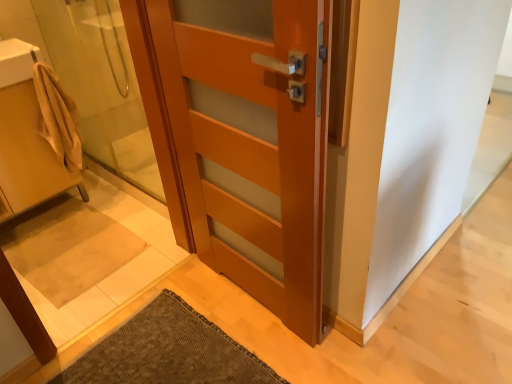
In order to face beige cotton bathrobe at left, should I rotate leftwards or rightwards?

Rotate your view left by about 25.017°.

What is the approximate height of beige fabric bath mat at lower left?

2.18 inches.

Where is `beige cotton bathrobe at left`? beige cotton bathrobe at left is located at coordinates (57, 117).

From the image's perspective, which one is positioned higher, beige fabric bath mat at lower left or white glossy sink at upper left, the first sink when ordered from top to bottom?

white glossy sink at upper left, the first sink when ordered from top to bottom, appears higher in the image.

Considering the sizes of beige fabric bath mat at lower left and white glossy sink at upper left, the first sink when ordered from top to bottom, in the image, is beige fabric bath mat at lower left wider or thinner than white glossy sink at upper left, the first sink when ordered from top to bottom,?

Clearly, beige fabric bath mat at lower left has more width compared to white glossy sink at upper left, the first sink when ordered from top to bottom.

Which is in front, beige fabric bath mat at lower left or white glossy sink at upper left, which ranks as the second sink in bottom-to-top order?

white glossy sink at upper left, which ranks as the second sink in bottom-to-top order.

Who is taller, beige fabric bath mat at lower left or white glossy sink at upper left, the first sink when ordered from top to bottom?

white glossy sink at upper left, the first sink when ordered from top to bottom, is taller.

Is matte wood door at center positioned with its back to beige fabric towel at left, which ranks as the first sink in bottom-to-top order?

No, matte wood door at center's orientation is not away from beige fabric towel at left, which ranks as the first sink in bottom-to-top order.

Is matte wood door at center not near beige fabric towel at left, the second sink positioned from the top?

Yes, matte wood door at center is far from beige fabric towel at left, the second sink positioned from the top.

Considering the positions of point (213, 44) and point (47, 187), is point (213, 44) closer or farther from the camera than point (47, 187)?

Point (213, 44) is closer to the camera than point (47, 187).

Considering the sizes of matte wood door at center and beige fabric towel at left, the second sink positioned from the top, in the image, is matte wood door at center bigger or smaller than beige fabric towel at left, the second sink positioned from the top,?

Clearly, matte wood door at center is smaller in size than beige fabric towel at left, the second sink positioned from the top.

In terms of height, does beige cotton bathrobe at left look taller or shorter compared to translucent glass shower door at left?

In the image, beige cotton bathrobe at left appears to be shorter than translucent glass shower door at left.

Locate an element on the screen. shower door that is in front of the beige cotton bathrobe at left is located at coordinates (101, 85).

Considering the positions of objects beige cotton bathrobe at left and translucent glass shower door at left in the image provided, who is more to the right, beige cotton bathrobe at left or translucent glass shower door at left?

translucent glass shower door at left is more to the right.

Consider the image. From a real-world perspective, is white glossy sink at upper left, which ranks as the second sink in bottom-to-top order, physically below beige fabric towel at left, which ranks as the first sink in bottom-to-top order?

No, from a real-world perspective, white glossy sink at upper left, which ranks as the second sink in bottom-to-top order, is not beneath beige fabric towel at left, which ranks as the first sink in bottom-to-top order.

Is white glossy sink at upper left, which ranks as the second sink in bottom-to-top order, touching beige fabric towel at left, the second sink positioned from the top?

No, white glossy sink at upper left, which ranks as the second sink in bottom-to-top order, is not making contact with beige fabric towel at left, the second sink positioned from the top.

Could you tell me if white glossy sink at upper left, the first sink when ordered from top to bottom, is facing beige fabric towel at left, which ranks as the first sink in bottom-to-top order?

No, white glossy sink at upper left, the first sink when ordered from top to bottom, is not oriented towards beige fabric towel at left, which ranks as the first sink in bottom-to-top order.

How different are the orientations of white glossy sink at upper left, the first sink when ordered from top to bottom, and beige fabric towel at left, the second sink positioned from the top, in degrees?

They differ by 0.000261 degrees in their facing directions.

Which sink is the 2nd one when counting from the left side of the translucent glass shower door at left? Please provide its 2D coordinates.

[(25, 137)]

Is translucent glass shower door at left surrounding beige fabric towel at left, which ranks as the first sink in bottom-to-top order?

No, translucent glass shower door at left does not contain beige fabric towel at left, which ranks as the first sink in bottom-to-top order.

Is the depth of translucent glass shower door at left less than that of beige fabric towel at left, which ranks as the first sink in bottom-to-top order?

Yes, translucent glass shower door at left is in front of beige fabric towel at left, which ranks as the first sink in bottom-to-top order.

Considering the sizes of translucent glass shower door at left and beige fabric towel at left, which ranks as the first sink in bottom-to-top order, in the image, is translucent glass shower door at left bigger or smaller than beige fabric towel at left, which ranks as the first sink in bottom-to-top order,?

Considering their sizes, translucent glass shower door at left takes up less space than beige fabric towel at left, which ranks as the first sink in bottom-to-top order.

Is beige cotton bathrobe at left further to camera compared to matte wood door at center?

That is True.

In the image, is beige cotton bathrobe at left on the left side or the right side of matte wood door at center?

In the image, beige cotton bathrobe at left appears on the left side of matte wood door at center.

Who is shorter, beige cotton bathrobe at left or matte wood door at center?

With less height is beige cotton bathrobe at left.

Find the location of a particular element. Image resolution: width=512 pixels, height=384 pixels. the 1st sink above the beige fabric bath mat at lower left (from a real-world perspective) is located at coordinates (25, 137).

Consider the image. Does beige fabric towel at left, which ranks as the first sink in bottom-to-top order, have a lesser height compared to beige fabric bath mat at lower left?

Incorrect, the height of beige fabric towel at left, which ranks as the first sink in bottom-to-top order, does not fall short of that of beige fabric bath mat at lower left.

Measure the distance from beige fabric towel at left, which ranks as the first sink in bottom-to-top order, to beige fabric bath mat at lower left.

beige fabric towel at left, which ranks as the first sink in bottom-to-top order, is 15.34 inches away from beige fabric bath mat at lower left.

From a real-world perspective, between beige fabric towel at left, the second sink positioned from the top, and beige fabric bath mat at lower left, who is vertically lower?

In real-world perspective, beige fabric bath mat at lower left is lower.

This screenshot has height=384, width=512. What are the coordinates of `bath mat below the white glossy sink at upper left, the first sink when ordered from top to bottom (from the image's perspective)` in the screenshot? It's located at (67, 247).

Which sink is the 2nd one when counting from the left side of the matte wood door at center? Please provide its 2D coordinates.

[(25, 137)]

Based on their spatial positions, is beige fabric towel at left, which ranks as the first sink in bottom-to-top order, or white glossy sink at upper left, which ranks as the second sink in bottom-to-top order, further from matte wood door at center?

Among the two, white glossy sink at upper left, which ranks as the second sink in bottom-to-top order, is located further to matte wood door at center.

Based on their spatial positions, is beige fabric towel at left, which ranks as the first sink in bottom-to-top order, or beige fabric bath mat at lower left closer to white glossy sink at upper left, which ranks as the second sink in bottom-to-top order?

beige fabric towel at left, which ranks as the first sink in bottom-to-top order, lies closer to white glossy sink at upper left, which ranks as the second sink in bottom-to-top order, than the other object.

Based on their spatial positions, is white glossy sink at upper left, which ranks as the second sink in bottom-to-top order, or translucent glass shower door at left closer to matte wood door at center?

translucent glass shower door at left is positioned closer to the anchor matte wood door at center.

When comparing their distances from matte wood door at center, does beige fabric towel at left, the second sink positioned from the top, or translucent glass shower door at left seem closer?

beige fabric towel at left, the second sink positioned from the top, is positioned closer to the anchor matte wood door at center.

Which object lies nearer to the anchor point beige cotton bathrobe at left, beige fabric towel at left, the second sink positioned from the top, or translucent glass shower door at left?

Based on the image, beige fabric towel at left, the second sink positioned from the top, appears to be nearer to beige cotton bathrobe at left.

Based on their spatial positions, is beige cotton bathrobe at left or beige fabric towel at left, the second sink positioned from the top, further from translucent glass shower door at left?

The object further to translucent glass shower door at left is beige fabric towel at left, the second sink positioned from the top.

Estimate the real-world distances between objects in this image. Which object is further from matte wood door at center, translucent glass shower door at left or beige fabric towel at left, which ranks as the first sink in bottom-to-top order?

Based on the image, translucent glass shower door at left appears to be further to matte wood door at center.

Which object lies nearer to the anchor point translucent glass shower door at left, beige cotton bathrobe at left or white glossy sink at upper left, which ranks as the second sink in bottom-to-top order?

beige cotton bathrobe at left is positioned closer to the anchor translucent glass shower door at left.

Where is `shower door that lies between white glossy sink at upper left, which ranks as the second sink in bottom-to-top order, and beige fabric towel at left, the second sink positioned from the top, from top to bottom`? This screenshot has width=512, height=384. shower door that lies between white glossy sink at upper left, which ranks as the second sink in bottom-to-top order, and beige fabric towel at left, the second sink positioned from the top, from top to bottom is located at coordinates (101, 85).

Where is `bathrobe between translucent glass shower door at left and beige fabric bath mat at lower left vertically`? This screenshot has height=384, width=512. bathrobe between translucent glass shower door at left and beige fabric bath mat at lower left vertically is located at coordinates (57, 117).

Locate an element on the screen. The image size is (512, 384). shower door between matte wood door at center and beige cotton bathrobe at left in the front-back direction is located at coordinates point(101,85).

Find the location of `bathrobe located between beige fabric towel at left, which ranks as the first sink in bottom-to-top order, and translucent glass shower door at left in the left-right direction`. bathrobe located between beige fabric towel at left, which ranks as the first sink in bottom-to-top order, and translucent glass shower door at left in the left-right direction is located at coordinates (57, 117).